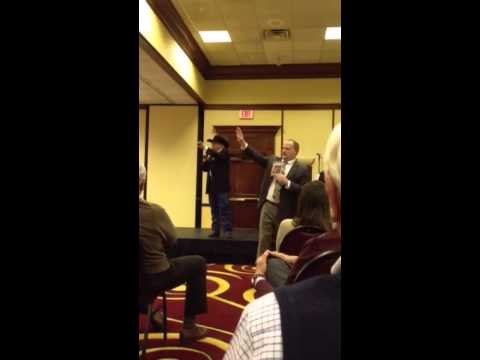
Locate an element on the screen. Image resolution: width=480 pixels, height=360 pixels. carpet is located at coordinates (231, 304).